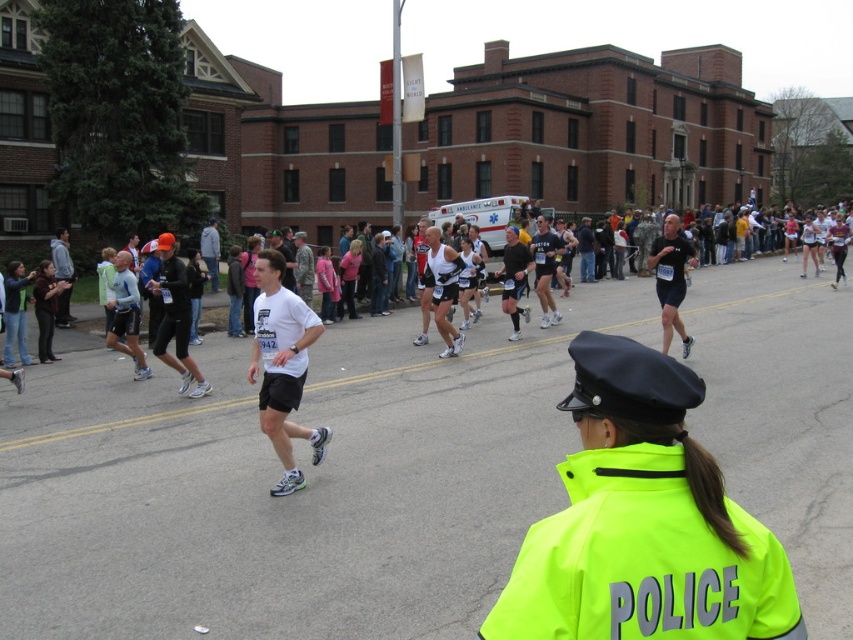
You are a photographer positioned at the marathon event. You need to capture a photo where both the neon yellow jacket at center and the matte black shorts at center are visible. Based on their heights, which object should you focus on first to ensure both are in the frame?

The neon yellow jacket at center is not as tall as matte black shorts at center, so you should focus on the matte black shorts at center first to ensure both are in the frame.

You are a photographer positioned at the front of the marathon route. You want to capture a photo of the neon yellow jacket at center and the matte black shorts at center. Which object will appear larger in your photo?

The neon yellow jacket at center will appear larger in the photo because it is closer to the viewer than the matte black shorts at center.